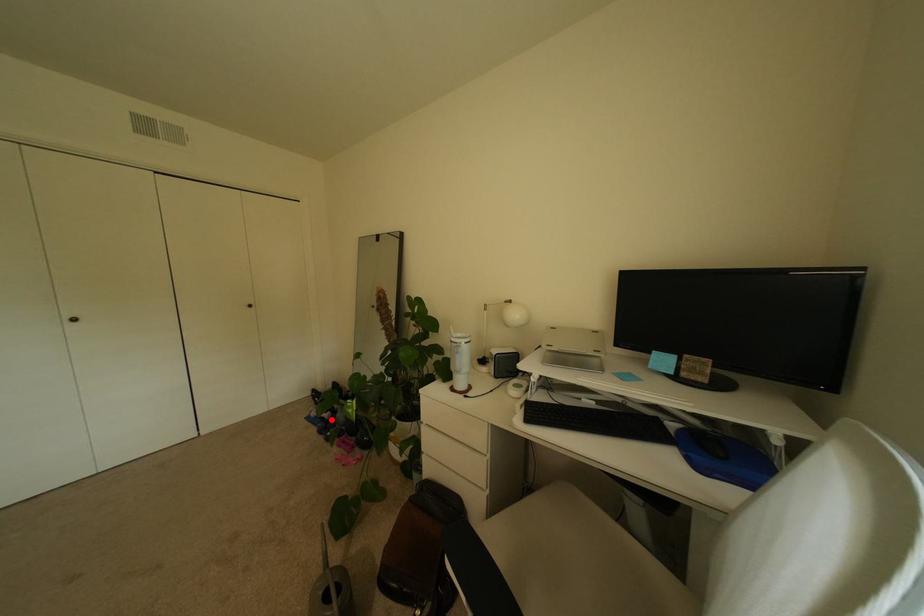
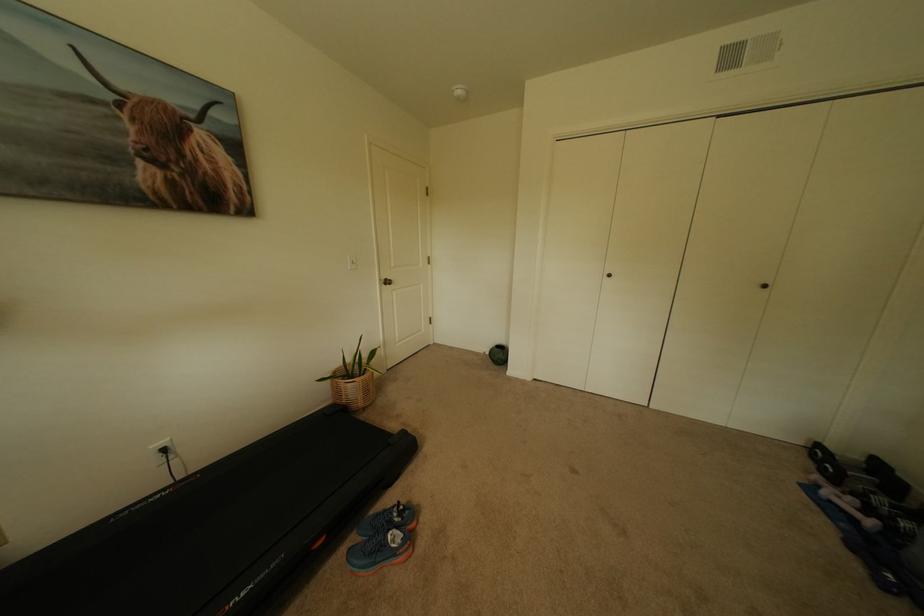
Question: A red point is marked in image1. In image2, is the corresponding 3D point closer to the camera or farther? Reply with the corresponding letter.

Choices:
 (A) The corresponding 3D point is closer.
 (B) The corresponding 3D point is farther.

Answer: (A)